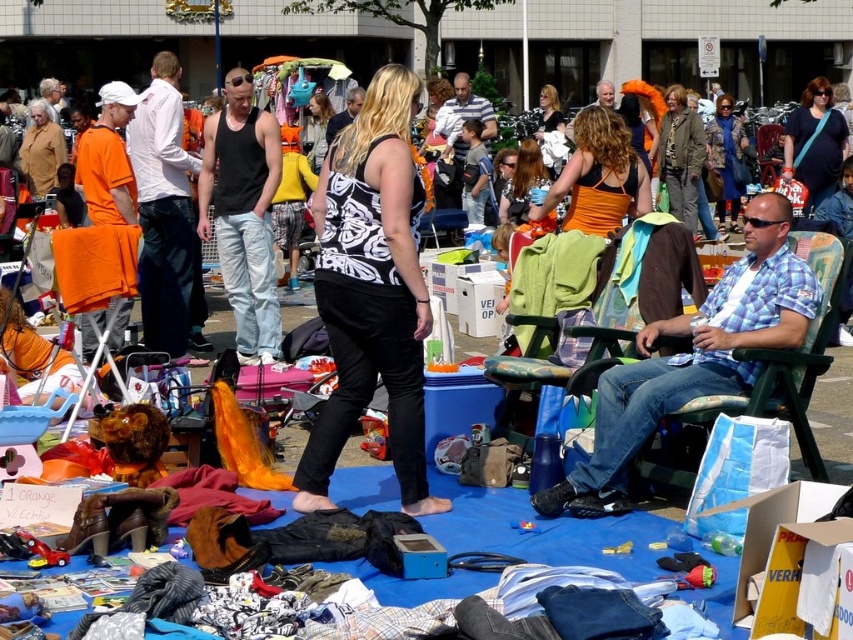
You are a customer at the flea market and see two black tank tops at the stall. The first one is labeled as a black matte tank top at center, and the second is labeled as a black tank top at center. According to the arrangement, which tank top is positioned to the right?

The black matte tank top at center is positioned to the right of the black tank top at center.

You are a customer at the flea market and want to buy both the black matte tank top at center and the black tank top at center. However, you notice that one of them is significantly farther away from you than the other. Which one should you pick up first to minimize walking distance?

The black matte tank top at center is 6.98 meters away from the black tank top at center. Since they are positioned at the same location, you can pick up either one first as they are in the same spot.

You are standing at the flea market and want to pick up an item located at point (360,228) and another item at point (751,244). Which item will you reach first if you move directly towards both points?

You will reach the item at point (360,228) first because it is closer to you than the item at point (751,244).